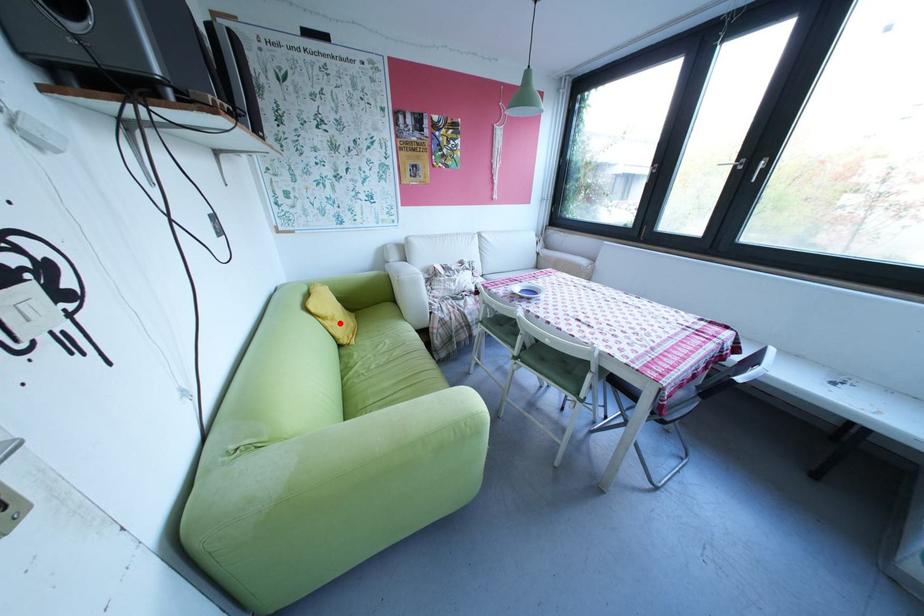
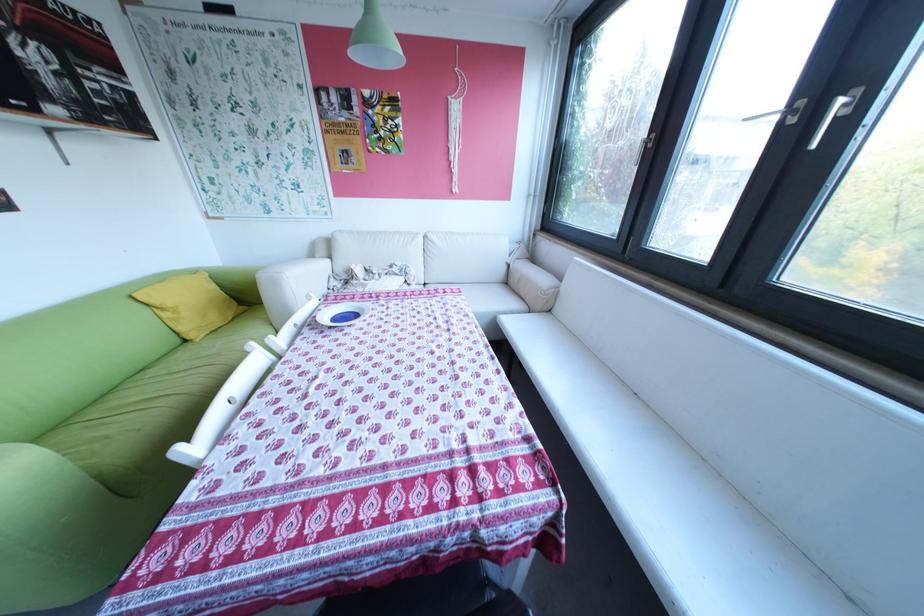
Question: I am providing you with two images of the same scene from different viewpoints. In image1, a red point is highlighted. Considering the same 3D point in image2, which of the following is correct?

Choices:
 (A) It is closer
 (B) It is farther

Answer: (B)